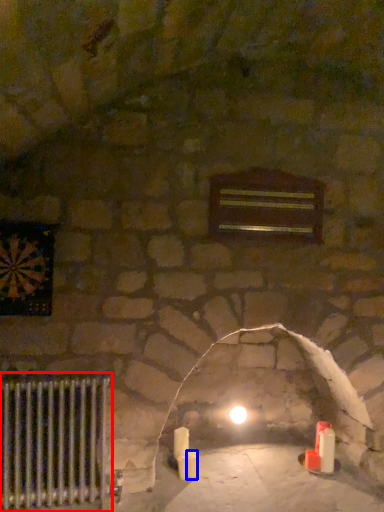
Question: Which object is closer to the camera taking this photo, radiator (highlighted by a red box) or candle (highlighted by a blue box)?

Choices:
 (A) radiator
 (B) candle

Answer: (A)